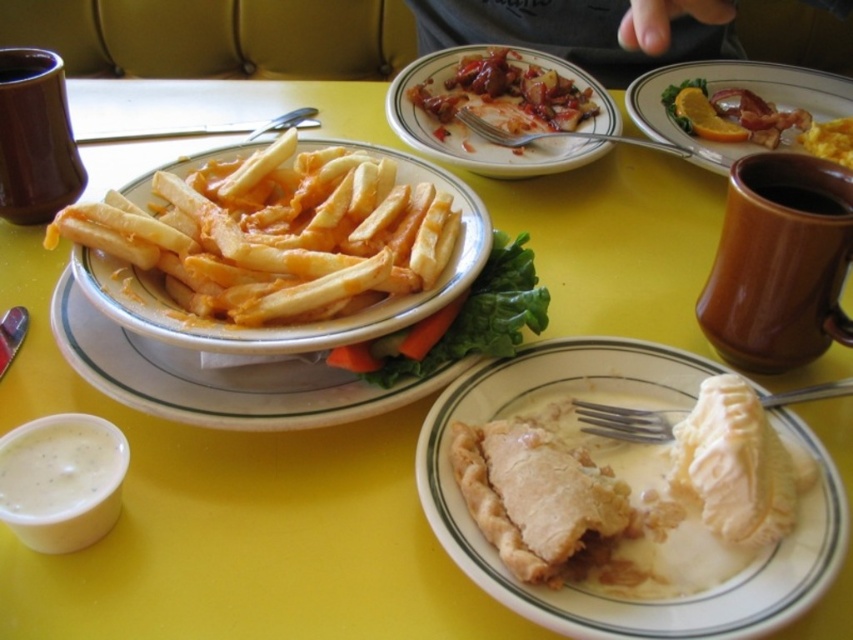
Question: Which object is closer to the camera taking this photo?

Choices:
 (A) shiny red sauce at center
 (B) matte white pie at center
 (C) matte brown plate at upper right

Answer: (B)

Question: Which is nearer to the shiny red sauce at center?

Choices:
 (A) matte brown plate at upper right
 (B) matte white pie at center
 (C) golden crispy fries at center
 (D) cheesy fried potatoes at center

Answer: (A)

Question: Does matte white pie at center have a lesser width compared to golden crispy fries at center?

Choices:
 (A) yes
 (B) no

Answer: (B)

Question: Can you confirm if matte white pie at center is positioned to the right of golden crispy fries at center?

Choices:
 (A) no
 (B) yes

Answer: (B)

Question: Considering the real-world distances, which object is farthest from the shiny red sauce at center?

Choices:
 (A) matte white pie at center
 (B) golden crispy fries at center

Answer: (A)

Question: From the image, what is the correct spatial relationship of shiny red sauce at center in relation to matte brown plate at upper right?

Choices:
 (A) left
 (B) right

Answer: (A)